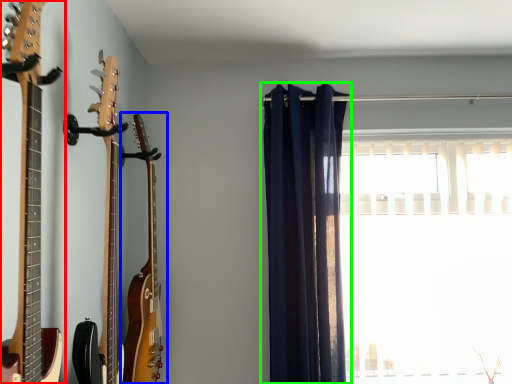
Question: Considering the real-world distances, which object is closest to guitar (highlighted by a red box)? guitar (highlighted by a blue box) or curtain (highlighted by a green box).

Choices:
 (A) guitar
 (B) curtain

Answer: (A)